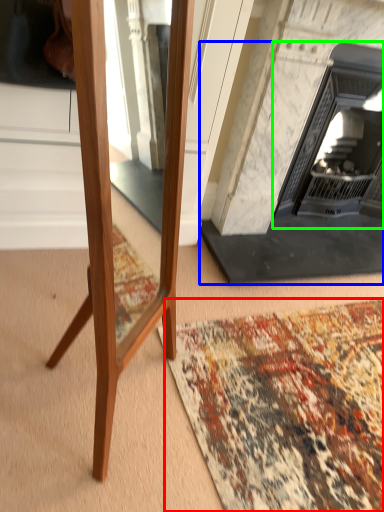
Question: Considering the real-world distances, which object is farthest from mat (highlighted by a red box)? fireplace (highlighted by a blue box) or fireplace (highlighted by a green box)?

Choices:
 (A) fireplace
 (B) fireplace

Answer: (B)